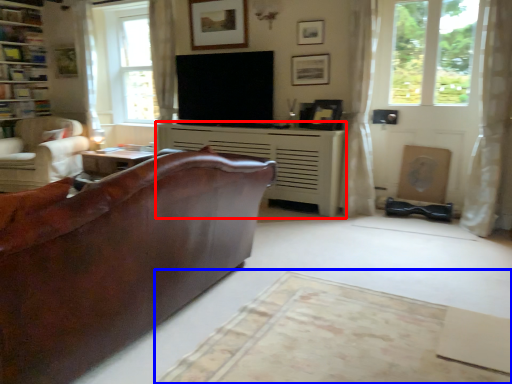
Question: Which point is further to the camera, fireplace (highlighted by a red box) or plain (highlighted by a blue box)?

Choices:
 (A) fireplace
 (B) plain

Answer: (A)